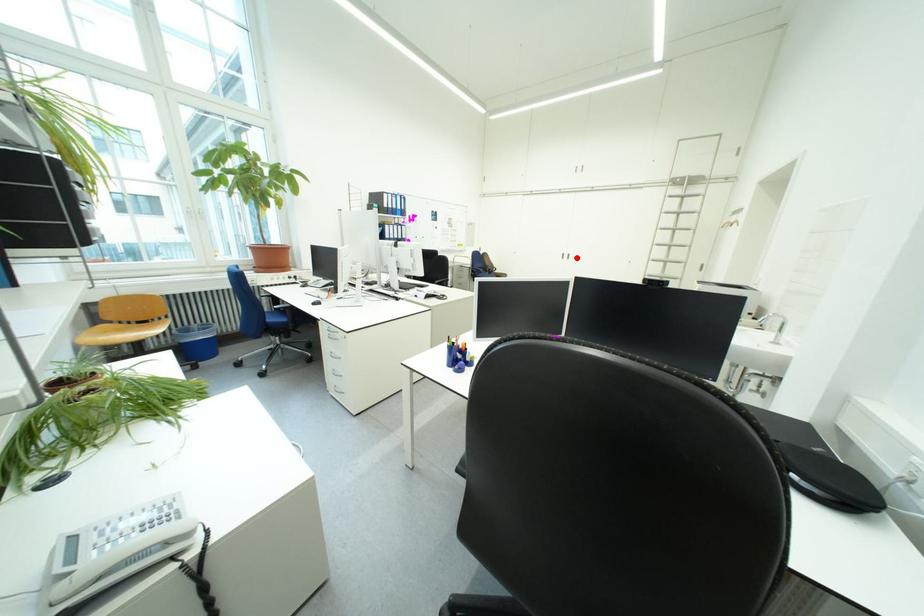
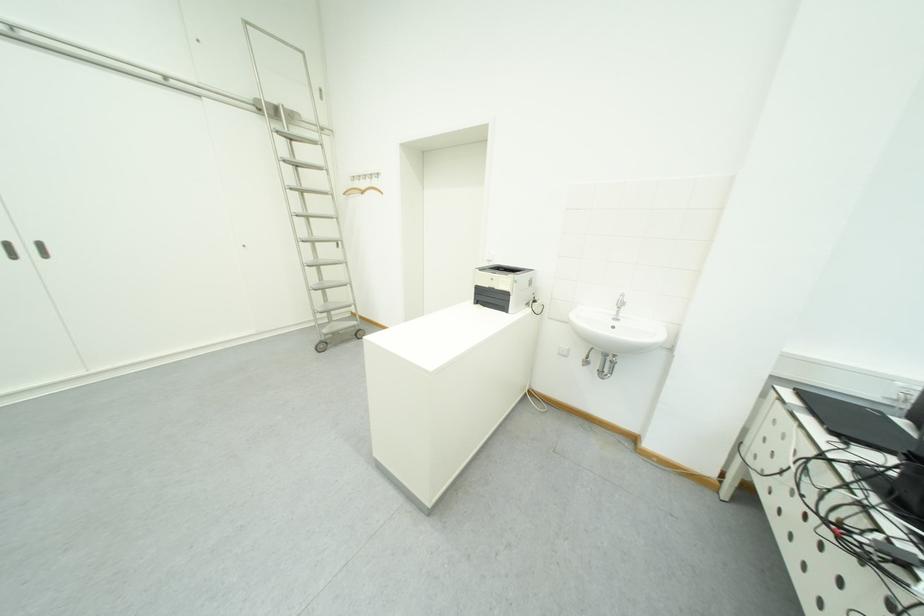
The point at the highlighted location is marked in the first image. Where is the corresponding point in the second image?

(40, 252)